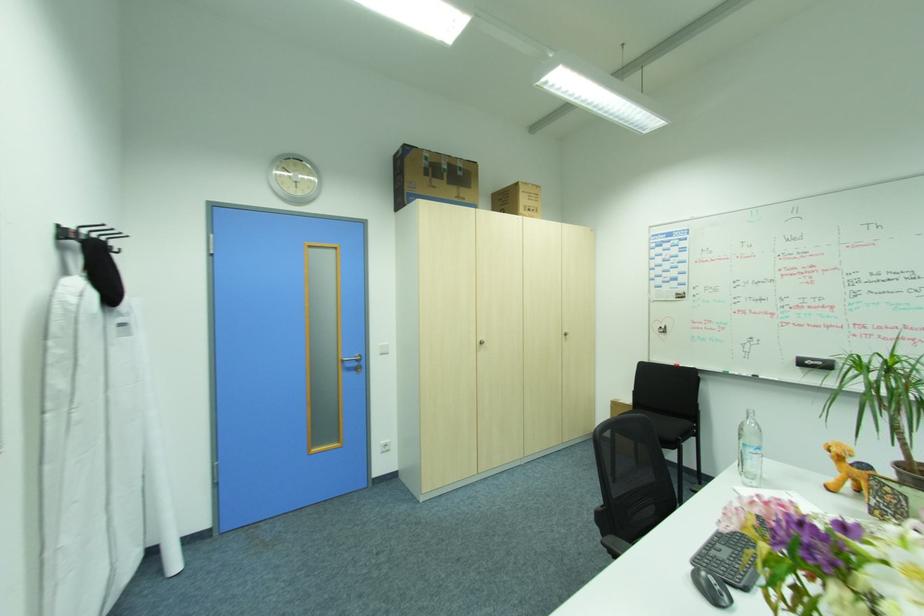
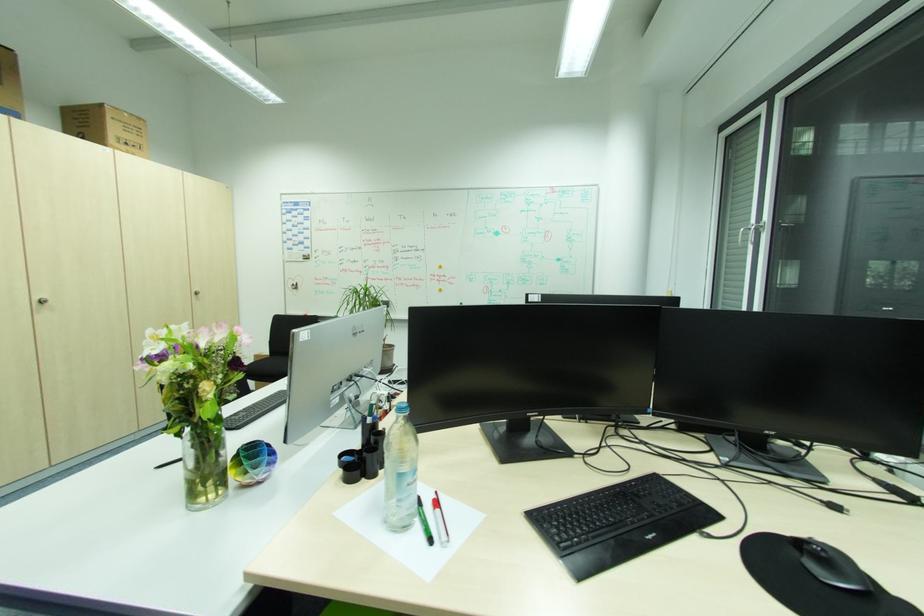
Locate, in the second image, the point that corresponds to pixel 541 199 in the first image.

(146, 134)